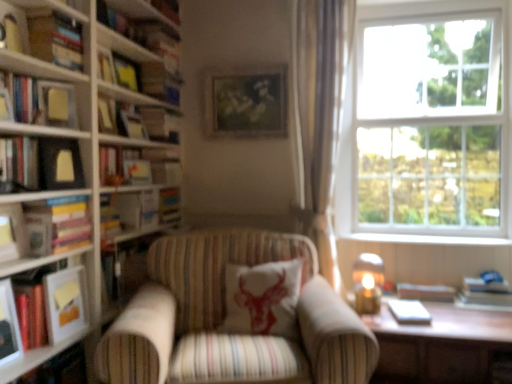
What do you see at coordinates (56, 105) in the screenshot? I see `matte yellow picture frame at upper left, placed as the 4th picture frame when sorted from right to left` at bounding box center [56, 105].

Image resolution: width=512 pixels, height=384 pixels. I want to click on hardcover book at left, marked as the 5th book in a bottom-to-top arrangement, so click(41, 164).

Is matte orange paperback book at left, the 1th paperback book from the top, turned away from hardcover book at upper center, the 1th book when ordered from top to bottom?

matte orange paperback book at left, the 1th paperback book from the top, does not have its back to hardcover book at upper center, the 1th book when ordered from top to bottom.

From the image's perspective, which is above, matte orange paperback book at left, the 1th paperback book when ordered from left to right, or hardcover book at upper center, the 1th book when ordered from top to bottom?

hardcover book at upper center, the 1th book when ordered from top to bottom, is shown above in the image.

From the image's perspective, count 6th books upward from the matte orange paperback book at left, the 1th paperback book when ordered from front to back, and point to it. Please provide its 2D coordinates.

[(168, 9)]

From a real-world perspective, who is located higher, wooden picture frame at upper center, marked as the fourth picture frame in a front-to-back arrangement, or matte yellow picture frame at upper left, which is the third picture frame from front to back?

matte yellow picture frame at upper left, which is the third picture frame from front to back, is physically above.

Where is `picture frame above the wooden picture frame at upper center, the first picture frame viewed from the right (from the image's perspective)`? picture frame above the wooden picture frame at upper center, the first picture frame viewed from the right (from the image's perspective) is located at coordinates (127, 72).

Which of these two, wooden picture frame at upper center, marked as the fourth picture frame in a left-to-right arrangement, or matte yellow picture frame at upper left, marked as the 2th picture frame in a back-to-front arrangement, is smaller?

Smaller between the two is matte yellow picture frame at upper left, marked as the 2th picture frame in a back-to-front arrangement.

In terms of height, does wooden picture frame at upper center, marked as the fourth picture frame in a front-to-back arrangement, look taller or shorter compared to matte yellow picture frame at upper left, which is the 2th picture frame from right to left?

In the image, wooden picture frame at upper center, marked as the fourth picture frame in a front-to-back arrangement, appears to be taller than matte yellow picture frame at upper left, which is the 2th picture frame from right to left.

Who is taller, white cotton cushion with red bull at center or hardcover book at left, the seventh book positioned from the top?

With more height is white cotton cushion with red bull at center.

Considering their positions, is white cotton cushion with red bull at center located in front of or behind hardcover book at left, the seventh book positioned from the top?

In the image, white cotton cushion with red bull at center appears behind hardcover book at left, the seventh book positioned from the top.

From a real-world perspective, is white cotton cushion with red bull at center positioned under hardcover book at left, which is counted as the 1th book, starting from the bottom, based on gravity?

Yes.

This screenshot has width=512, height=384. Find the location of `curtain above the matte orange book at left, the 6th book viewed from the top (from the image's perspective)`. curtain above the matte orange book at left, the 6th book viewed from the top (from the image's perspective) is located at coordinates (320, 114).

From the picture: Is matte orange book at left, the 6th book viewed from the top, not near silky beige curtain at right?

Yes.

From a real-world perspective, between matte orange book at left, which is the 2th book from bottom to top, and silky beige curtain at right, who is vertically lower?

From a 3D spatial view, matte orange book at left, which is the 2th book from bottom to top, is below.

Is point (4, 287) behind point (318, 172)?

No, (4, 287) is in front of (318, 172).

From a real-world perspective, is silky beige curtain at right on top of hardcover book at left, the seventh book positioned from the top?

Yes, from a real-world perspective, silky beige curtain at right is over hardcover book at left, the seventh book positioned from the top

Which is behind, silky beige curtain at right or hardcover book at left, the seventh book positioned from the top?

Positioned behind is silky beige curtain at right.

Does silky beige curtain at right contain hardcover book at left, the seventh book positioned from the top?

No, hardcover book at left, the seventh book positioned from the top, is not inside silky beige curtain at right.

Considering the sizes of objects silky beige curtain at right and hardcover book at left, which is counted as the 1th book, starting from the bottom, in the image provided, who is bigger, silky beige curtain at right or hardcover book at left, which is counted as the 1th book, starting from the bottom,?

silky beige curtain at right.

Looking at this image, from the image's perspective, which object appears higher, matte yellow picture frame at upper left, which appears as the first picture frame when viewed from the left, or wooden picture frame at upper center, marked as the fourth picture frame in a left-to-right arrangement?

wooden picture frame at upper center, marked as the fourth picture frame in a left-to-right arrangement, appears higher in the image.

Based on the photo, which point is more forward, (41, 96) or (231, 113)?

The point (41, 96) is in front.

Which picture frame is the 2nd one when counting from the front of the wooden picture frame at upper center, which is the first picture frame in back-to-front order? Please provide its 2D coordinates.

[(56, 105)]

Does matte yellow picture frame at upper left, acting as the 2th picture frame starting from the front, have a greater width compared to wooden picture frame at upper center, marked as the fourth picture frame in a front-to-back arrangement?

No.

From the image's perspective, would you say white wood at right is positioned over matte yellow picture frame at upper left, which appears as the first picture frame when viewed from the left?

No, from the image's perspective, white wood at right is not on top of matte yellow picture frame at upper left, which appears as the first picture frame when viewed from the left.

Would you say white wood at right is inside or outside matte yellow picture frame at upper left, acting as the 2th picture frame starting from the front?

white wood at right is spatially situated outside matte yellow picture frame at upper left, acting as the 2th picture frame starting from the front.

Find the location of a particular element. The image size is (512, 384). window sill lying behind the matte yellow picture frame at upper left, which appears as the first picture frame when viewed from the left is located at coordinates (426, 239).

Is white wood at right in contact with matte yellow picture frame at upper left, placed as the 4th picture frame when sorted from right to left?

white wood at right and matte yellow picture frame at upper left, placed as the 4th picture frame when sorted from right to left, are not in contact.

Find the location of a particular element. The width and height of the screenshot is (512, 384). paperback book on the left side of hardcover book at upper center, acting as the 7th book starting from the bottom is located at coordinates (65, 303).

From the wooden picture frame at upper center, marked as the fourth picture frame in a left-to-right arrangement, count 1st picture frames forward and point to it. Please provide its 2D coordinates.

[(127, 72)]

When comparing their distances from wooden table at lower right, does white matte paperback book at lower right, which is the first paperback book from back to front, or white wood at right seem closer?

The object closer to wooden table at lower right is white matte paperback book at lower right, which is the first paperback book from back to front.

Estimate the real-world distances between objects in this image. Which object is closer to white cotton cushion with red bull at center, matte yellow picture frame at upper left, placed as the 4th picture frame when sorted from right to left, or white wood at right?

Based on the image, white wood at right appears to be nearer to white cotton cushion with red bull at center.

When comparing their distances from clear glass window at upper right, does hardcover book at left, marked as the 5th book in a top-to-bottom arrangement, or matte yellow picture frame at upper left, acting as the 2th picture frame starting from the front, seem closer?

hardcover book at left, marked as the 5th book in a top-to-bottom arrangement.

Estimate the real-world distances between objects in this image. Which object is further from matte yellow picture frame at upper left, which is the third picture frame from front to back, hardcover book at upper left, which ranks as the second book in top-to-bottom order, or white cotton cushion with red bull at center?

white cotton cushion with red bull at center lies further to matte yellow picture frame at upper left, which is the third picture frame from front to back, than the other object.

Based on their spatial positions, is hardcover book at left, which is counted as the fourth book, starting from the top, or striped fabric armchair at center closer to white wood at right?

Based on the image, striped fabric armchair at center appears to be nearer to white wood at right.

Estimate the real-world distances between objects in this image. Which object is further from hardcover book at left, which is the 4th book from bottom to top, white matte paperback book at lower right, the 1th paperback book in the right-to-left sequence, or clear glass window at upper right?

white matte paperback book at lower right, the 1th paperback book in the right-to-left sequence.

From the image, which object appears to be nearer to matte orange book at left, the 6th book viewed from the top, hardcover book at upper left, which ranks as the second book in top-to-bottom order, or wooden table at lower right?

hardcover book at upper left, which ranks as the second book in top-to-bottom order, is closer to matte orange book at left, the 6th book viewed from the top.

Estimate the real-world distances between objects in this image. Which object is closer to hardcover book at left, which is counted as the fourth book, starting from the top, hardcover book at left, marked as the 5th book in a bottom-to-top arrangement, or silky beige curtain at right?

Among the two, hardcover book at left, marked as the 5th book in a bottom-to-top arrangement, is located nearer to hardcover book at left, which is counted as the fourth book, starting from the top.

Identify the location of paperback book between matte black picture frame at left, the 4th picture frame positioned from the back, and silky beige curtain at right, in the horizontal direction. (65, 303).

I want to click on paperback book located between hardcover book at left, marked as the 5th book in a bottom-to-top arrangement, and white matte paperback book at lower right, the 1th paperback book in the right-to-left sequence, in the left-right direction, so click(65, 303).

You are a GUI agent. You are given a task and a screenshot of the screen. Output one action in this format:
    pyautogui.click(x=<x>, y=<y>)
    Task: Click on the candle holder situated between matte orange paperback book at left, marked as the second paperback book in a bottom-to-top arrangement, and clear glass window at upper right from left to right
    This screenshot has height=384, width=512.
    Given the screenshot: What is the action you would take?
    pyautogui.click(x=367, y=293)

Identify the location of curtain located between wooden picture frame at upper center, the first picture frame viewed from the right, and white wood at right in the left-right direction. This screenshot has width=512, height=384. (320, 114).